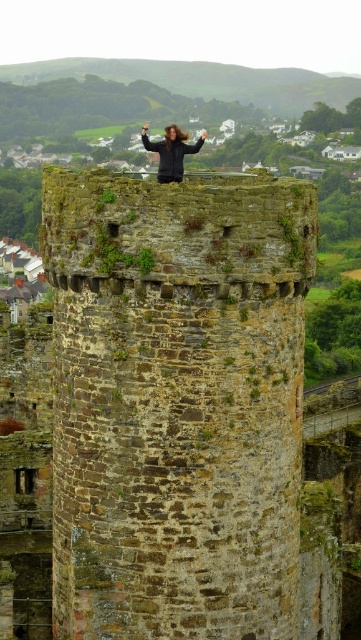
You are standing at point (105, 212) and want to walk to the base of the stone tower. The tower is 24.90 meters away from your current position. If you walk straight towards the tower, will you reach the base before reaching the edge of the castle grounds, which is 30 meters away from your current position?

Yes, because the tower is only 24.90 meters away, which is less than the 30 meters to the edge of the castle grounds. You will reach the base of the tower before the edge.

You are an architect analyzing the structure of the brown stone tower at center and the dark brown hair at top. Which object has a smaller width according to the scene?

The brown stone tower at center has a lesser width compared to the dark brown hair at top, so the brown stone tower at center is narrower.